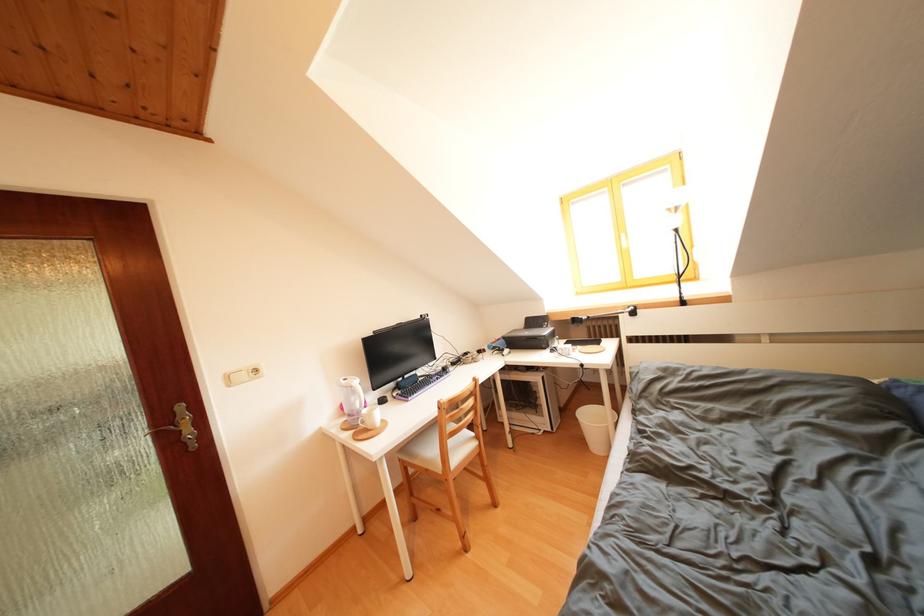
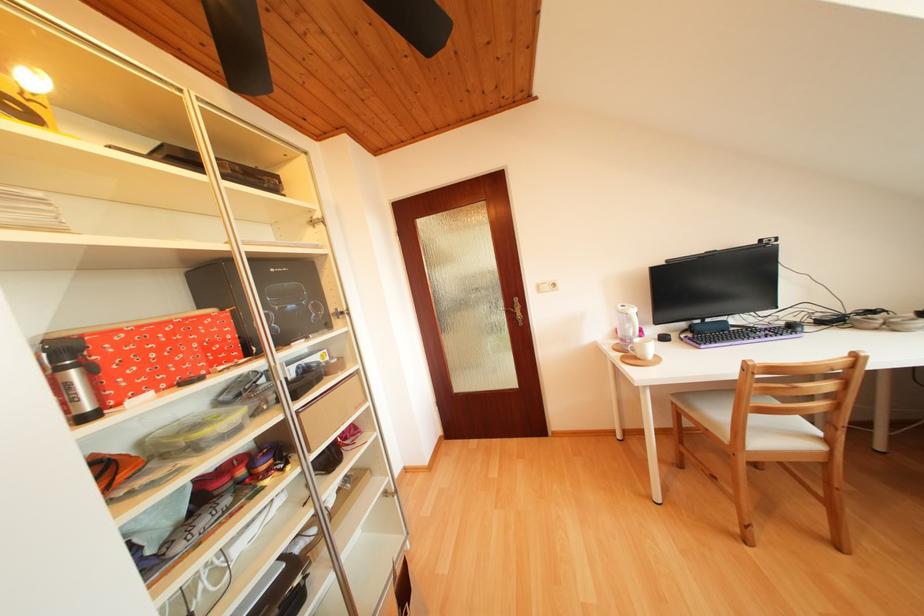
In the second image, find the point that corresponds to point (454, 375) in the first image.

(799, 331)